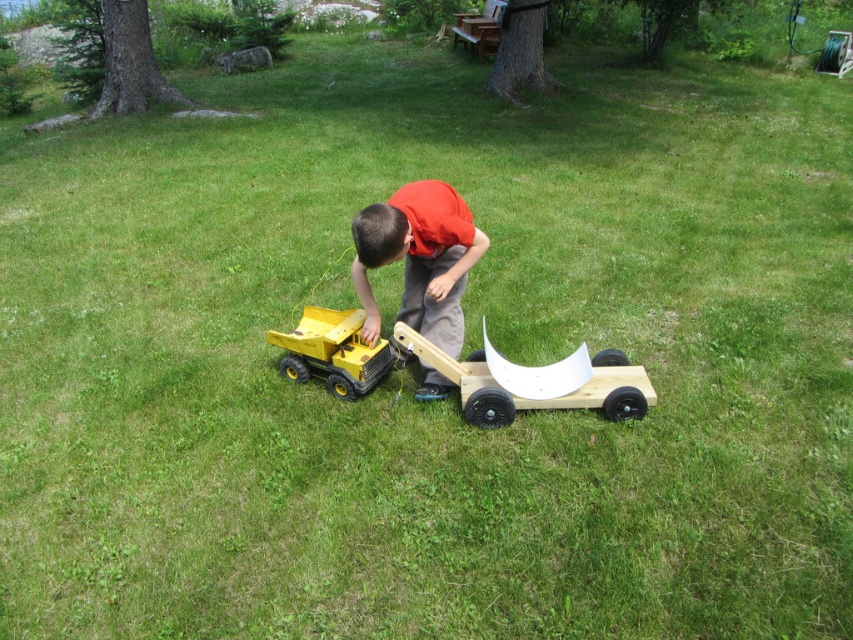
What are the coordinates of the orange cotton shirt at center?

The orange cotton shirt at center is located at coordinates point [419,259].

You are a parent trying to find your child who is playing in the grassy area. You see an orange cotton shirt at center and a yellow plastic toy truck at lower center. Which object is taller and could help you locate your child?

The orange cotton shirt at center is much taller than the yellow plastic toy truck at lower center, so it would be easier to spot from a distance and help locate your child.

You are a child who wants to carry a bag of sand. You have two options in the scene, the wooden cart at center and the yellow plastic toy truck at lower center. Which one can carry the bag of sand more effectively and why?

The wooden cart at center is bigger than the yellow plastic toy truck at lower center, so it can carry the bag of sand more effectively because of its larger size and sturdier structure.